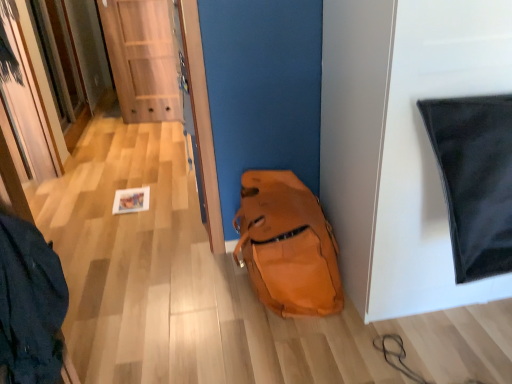
Question: Which is correct: orange leather backpack at lower center is inside wooden door at center, or outside of it?

Choices:
 (A) inside
 (B) outside

Answer: (B)

Question: Is orange leather backpack at lower center in front of or behind wooden door at center in the image?

Choices:
 (A) front
 (B) behind

Answer: (A)

Question: Looking at their shapes, would you say orange leather backpack at lower center is wider or thinner than wooden door at center?

Choices:
 (A) wide
 (B) thin

Answer: (A)

Question: Is wooden door at center inside the boundaries of orange leather backpack at lower center, or outside?

Choices:
 (A) outside
 (B) inside

Answer: (A)

Question: From a real-world perspective, is wooden door at center positioned above or below orange leather backpack at lower center?

Choices:
 (A) above
 (B) below

Answer: (A)

Question: From the image's perspective, is wooden door at center positioned above or below orange leather backpack at lower center?

Choices:
 (A) below
 (B) above

Answer: (B)

Question: In terms of height, does wooden door at center look taller or shorter compared to orange leather backpack at lower center?

Choices:
 (A) short
 (B) tall

Answer: (B)